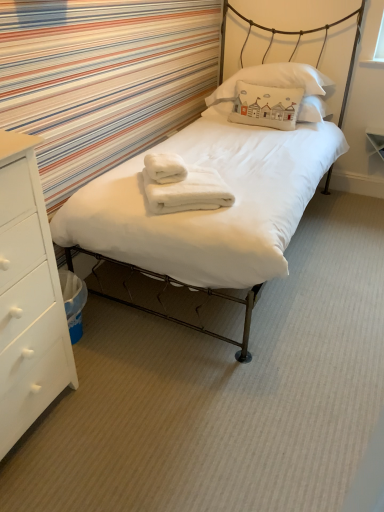
Question: Can you confirm if white fluffy bath towel at center, placed as the 2th bath towel when sorted from bottom to top, is positioned to the left of white cotton pillow at upper center, the 1th pillow ordered from the bottom?

Choices:
 (A) no
 (B) yes

Answer: (B)

Question: Could you tell me if white fluffy bath towel at center, placed as the 2th bath towel when sorted from bottom to top, is facing white cotton pillow at upper center, which is counted as the 2th pillow, starting from the top?

Choices:
 (A) yes
 (B) no

Answer: (B)

Question: Can you confirm if white fluffy bath towel at center, acting as the first bath towel starting from the top, is taller than white cotton pillow at upper center, the 1th pillow ordered from the bottom?

Choices:
 (A) no
 (B) yes

Answer: (A)

Question: From a real-world perspective, is white fluffy bath towel at center, acting as the first bath towel starting from the top, beneath white cotton pillow at upper center, the 1th pillow ordered from the bottom?

Choices:
 (A) yes
 (B) no

Answer: (A)

Question: Is white fluffy bath towel at center, acting as the first bath towel starting from the top, oriented away from white cotton pillow at upper center, which is counted as the 2th pillow, starting from the top?

Choices:
 (A) no
 (B) yes

Answer: (A)

Question: Does white fluffy bath towel at center, acting as the first bath towel starting from the top, have a lesser width compared to white cotton pillow at upper center, which is counted as the 2th pillow, starting from the top?

Choices:
 (A) no
 (B) yes

Answer: (A)

Question: From the image's perspective, is white matte chest of drawers at left above white soft bed at center?

Choices:
 (A) no
 (B) yes

Answer: (A)

Question: Does white matte chest of drawers at left appear on the right side of white soft bed at center?

Choices:
 (A) yes
 (B) no

Answer: (B)

Question: Is white matte chest of drawers at left facing towards white soft bed at center?

Choices:
 (A) yes
 (B) no

Answer: (B)

Question: Is white matte chest of drawers at left oriented away from white soft bed at center?

Choices:
 (A) no
 (B) yes

Answer: (A)

Question: Would you say white matte chest of drawers at left is a long distance from white soft bed at center?

Choices:
 (A) yes
 (B) no

Answer: (B)

Question: Does white matte chest of drawers at left have a greater height compared to white soft bed at center?

Choices:
 (A) yes
 (B) no

Answer: (B)

Question: Is there a large distance between white cotton pillow at upper center, the 1th pillow ordered from the bottom, and white cotton pillow at upper center, the second pillow in the bottom-to-top sequence?

Choices:
 (A) no
 (B) yes

Answer: (A)